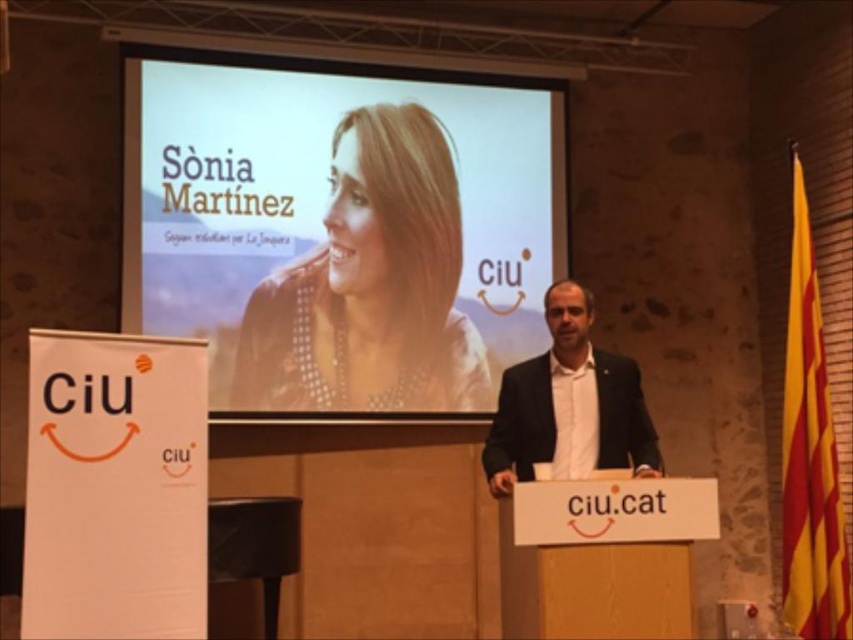
Who is more distant from viewer, (407, 356) or (601, 451)?

Positioned behind is point (407, 356).

Is smooth beige blouse at upper center wider than dark suit at center?

Correct, the width of smooth beige blouse at upper center exceeds that of dark suit at center.

Find the location of a particular element. smooth beige blouse at upper center is located at coordinates (370, 285).